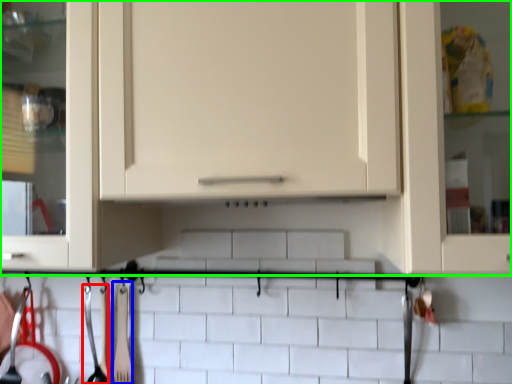
Question: Which object is positioned closest to silverware (highlighted by a red box)? Select from silverware (highlighted by a blue box) and cabinetry (highlighted by a green box).

Choices:
 (A) silverware
 (B) cabinetry

Answer: (A)